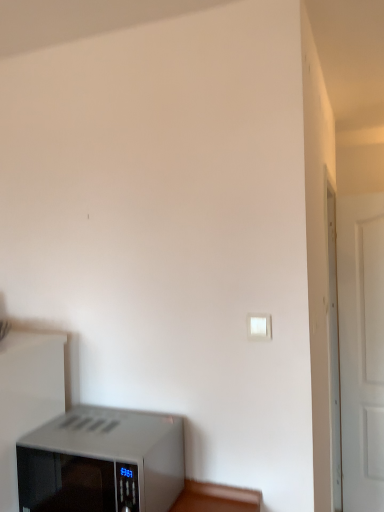
Question: Which is correct: white matte door at right is inside white plastic light switch at upper right, or outside of it?

Choices:
 (A) outside
 (B) inside

Answer: (A)

Question: From a real-world perspective, is white matte door at right above or below white plastic light switch at upper right?

Choices:
 (A) below
 (B) above

Answer: (A)

Question: Based on their relative distances, which object is farther from the white plastic light switch at upper right?

Choices:
 (A) white matte door at right
 (B) satin silver microwave at lower left

Answer: (A)

Question: Which object is the closest to the satin silver microwave at lower left?

Choices:
 (A) white matte door at right
 (B) white plastic light switch at upper right

Answer: (B)